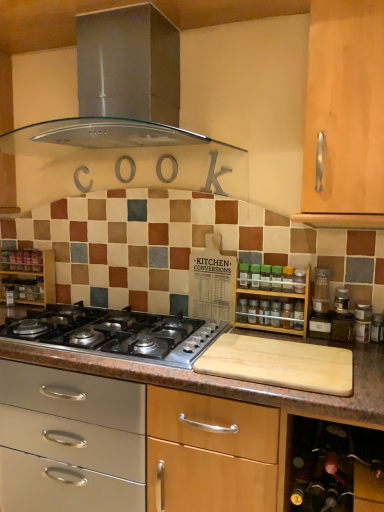
Question: Considering the positions of point (51, 330) and point (238, 300), is point (51, 330) closer or farther from the camera than point (238, 300)?

Choices:
 (A) farther
 (B) closer

Answer: (B)

Question: Based on their positions, is polished stainless steel gas stove at center located to the left or right of transparent glass spice at center, the 2th bottle in the right-to-left sequence?

Choices:
 (A) left
 (B) right

Answer: (A)

Question: Which is nearer to the transparent glass spice at center, the 2th bottle in the right-to-left sequence?

Choices:
 (A) polished stainless steel gas stove at center
 (B) wooden spice rack at center
 (C) stainless steel range hood at upper center
 (D) wooden spice rack at right, arranged as the 2th shelf when viewed from the back
 (E) green glass spice at center, marked as the second bottle in a bottom-to-top arrangement

Answer: (B)

Question: Considering the real-world distances, which object is farthest from the wooden shelf at left, the 2th shelf in the right-to-left sequence?

Choices:
 (A) wooden spice rack at right, arranged as the 2th shelf when viewed from the back
 (B) transparent glass spice at center, the first bottle from the left
 (C) green glass spice at center, the first bottle positioned from the front
 (D) polished stainless steel gas stove at center
 (E) stainless steel range hood at upper center

Answer: (C)